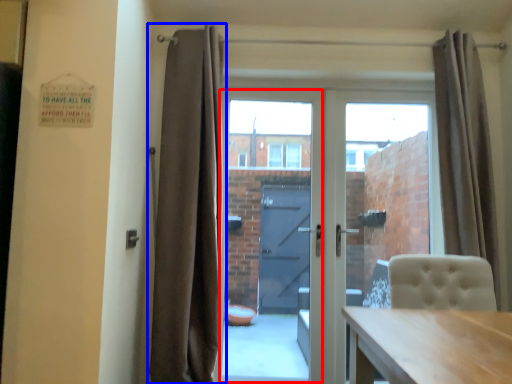
Question: Which point is further to the camera, glass door (highlighted by a red box) or curtain (highlighted by a blue box)?

Choices:
 (A) glass door
 (B) curtain

Answer: (A)